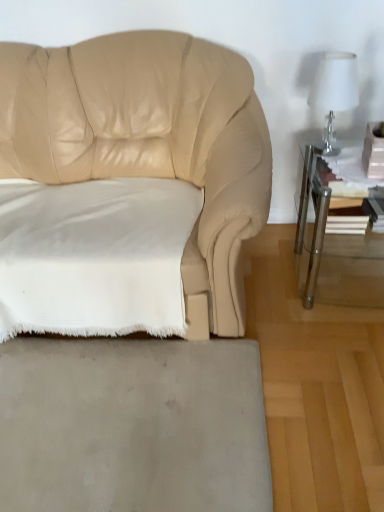
Locate an element on the screen. This screenshot has width=384, height=512. vacant space underneath clear glass table at right (from a real-world perspective) is located at coordinates (347, 278).